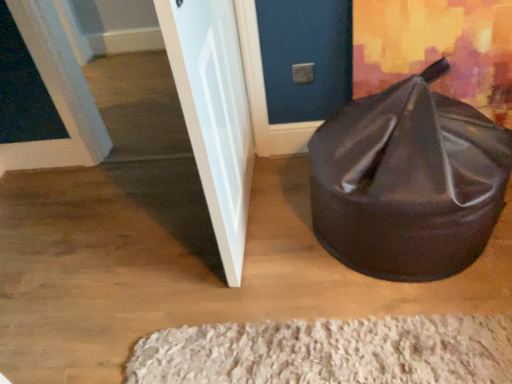
You are a GUI agent. You are given a task and a screenshot of the screen. Output one action in this format:
    pyautogui.click(x=<x>, y=<y>)
    Task: Click on the free region on the left part of white glossy door at left, the second door from the left
    
    Given the screenshot: What is the action you would take?
    click(137, 236)